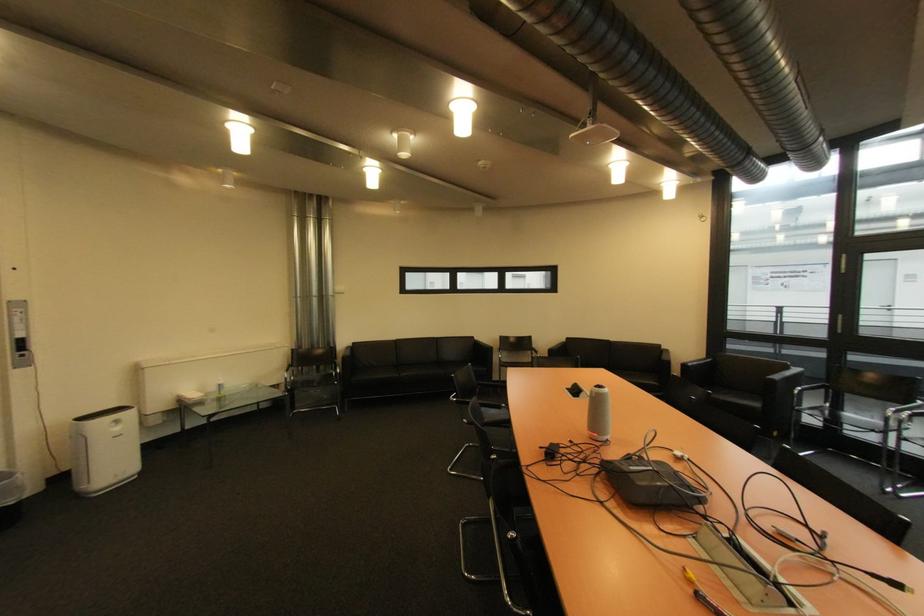
Where is `grey conference speaker`? grey conference speaker is located at coordinates (599, 413).